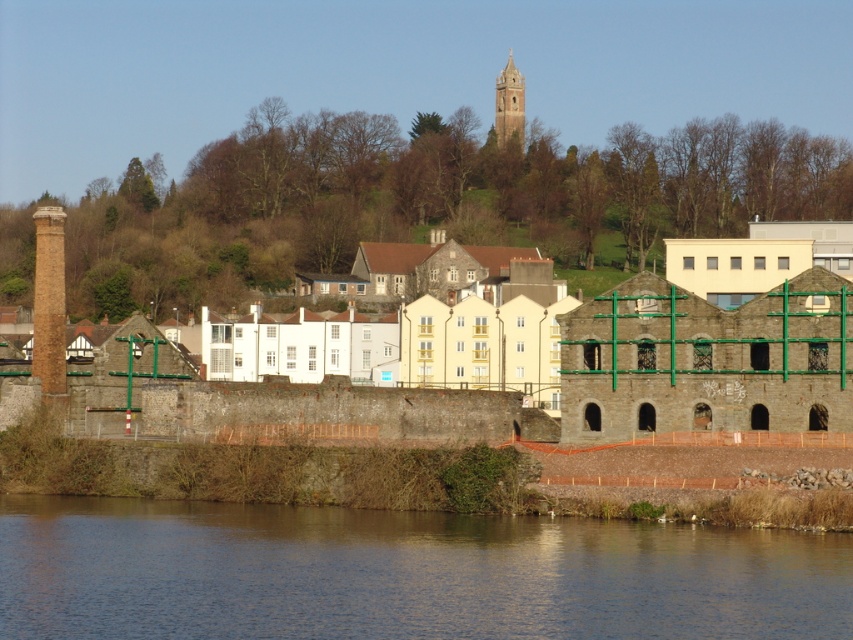
You are standing at the center of the image and want to reach the brown water at lower left. Which direction should you move in to get there?

To reach the brown water at lower left, you should move towards the lower left direction from your current position at the center of the image.

You are standing at the riverside and want to take a photo of the rustic stone building at center without the brown water at lower left appearing in the frame. Is this possible given their positions?

The brown water at lower left is closer to the viewer than the rustic stone building at center. To avoid the water in the photo, you would need to position yourself so that the building is framed behind the water or adjust your angle to exclude the water from the shot.